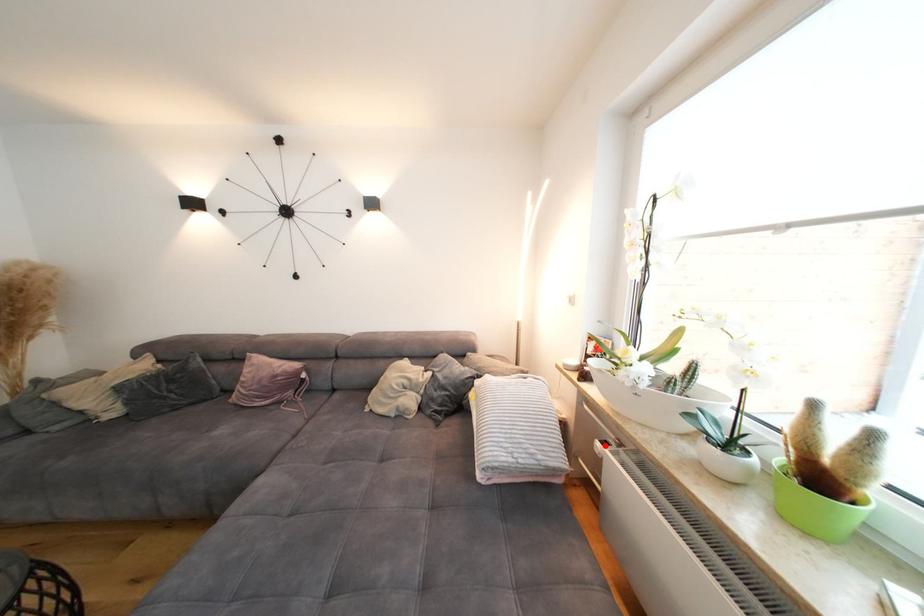
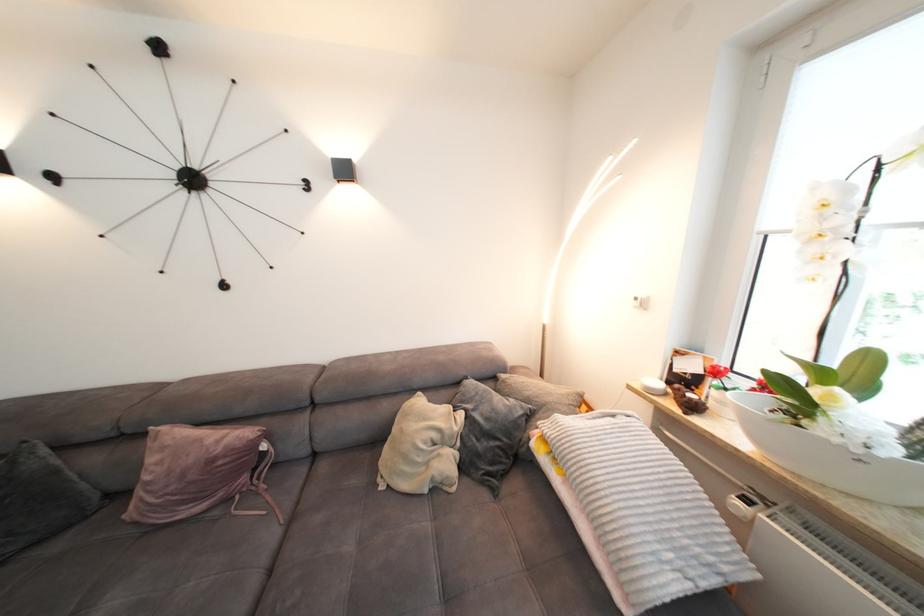
Question: I am providing you with two images of the same scene from different viewpoints. In image1, a red point is highlighted. Considering the same 3D point in image2, which of the following is correct?

Choices:
 (A) It is closer
 (B) It is farther

Answer: (B)